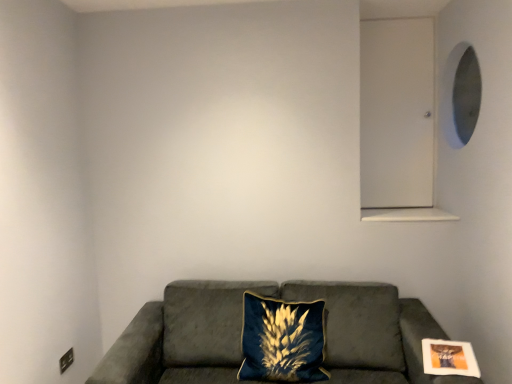
Question: Can you confirm if velvet blue pillow at center is bigger than suede couch at lower center?

Choices:
 (A) no
 (B) yes

Answer: (A)

Question: Could suede couch at lower center be considered to be inside velvet blue pillow at center?

Choices:
 (A) yes
 (B) no

Answer: (B)

Question: Considering the relative sizes of velvet blue pillow at center and suede couch at lower center in the image provided, is velvet blue pillow at center wider than suede couch at lower center?

Choices:
 (A) yes
 (B) no

Answer: (B)

Question: Is velvet blue pillow at center not inside suede couch at lower center?

Choices:
 (A) no
 (B) yes

Answer: (A)

Question: Is velvet blue pillow at center to the left of suede couch at lower center from the viewer's perspective?

Choices:
 (A) yes
 (B) no

Answer: (B)

Question: Can you confirm if velvet blue pillow at center is thinner than suede couch at lower center?

Choices:
 (A) yes
 (B) no

Answer: (A)

Question: Does velvet blue pillow at center have a greater width compared to matte white picture frame at lower right?

Choices:
 (A) yes
 (B) no

Answer: (A)

Question: Is velvet blue pillow at center not within matte white picture frame at lower right?

Choices:
 (A) yes
 (B) no

Answer: (A)

Question: Is the position of velvet blue pillow at center more distant than that of matte white picture frame at lower right?

Choices:
 (A) yes
 (B) no

Answer: (A)

Question: Is matte white picture frame at lower right surrounded by velvet blue pillow at center?

Choices:
 (A) no
 (B) yes

Answer: (A)

Question: Is velvet blue pillow at center bigger than matte white picture frame at lower right?

Choices:
 (A) no
 (B) yes

Answer: (B)

Question: From the image's perspective, is velvet blue pillow at center located beneath matte white picture frame at lower right?

Choices:
 (A) no
 (B) yes

Answer: (B)

Question: Can you confirm if matte white picture frame at lower right is smaller than suede couch at lower center?

Choices:
 (A) yes
 (B) no

Answer: (A)